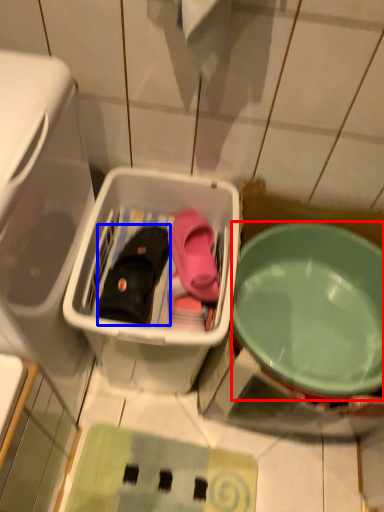
Question: Among these objects, which one is farthest to the camera, bowl (highlighted by a red box) or footwear (highlighted by a blue box)?

Choices:
 (A) bowl
 (B) footwear

Answer: (B)